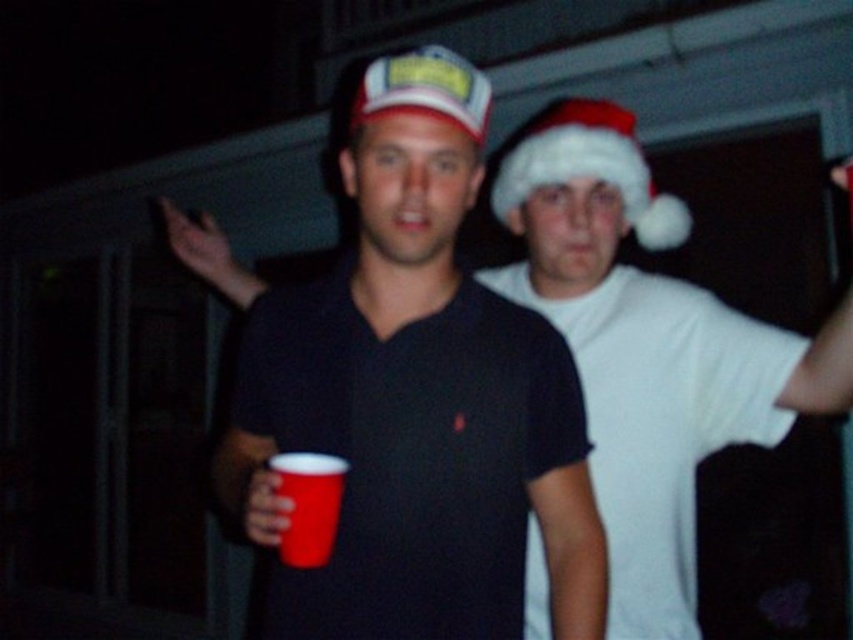
Question: Is white fluffy santa hat at upper right positioned at the back of red plastic cup at center?

Choices:
 (A) yes
 (B) no

Answer: (A)

Question: Which point appears closest to the camera in this image?

Choices:
 (A) (461, 102)
 (B) (293, 493)

Answer: (B)

Question: Is matte plastic cup at center to the right of red plastic cup at center from the viewer's perspective?

Choices:
 (A) no
 (B) yes

Answer: (B)

Question: Is matte plastic cup at center smaller than white fluffy santa hat at upper right?

Choices:
 (A) yes
 (B) no

Answer: (B)

Question: Which is farther from the matte plastic cup at center?

Choices:
 (A) white fluffy santa hat at upper right
 (B) red plastic cup at center

Answer: (A)

Question: Based on their relative distances, which object is farther from the matte plastic cup at center?

Choices:
 (A) matte plastic cap at center
 (B) white fluffy santa hat at upper right

Answer: (B)